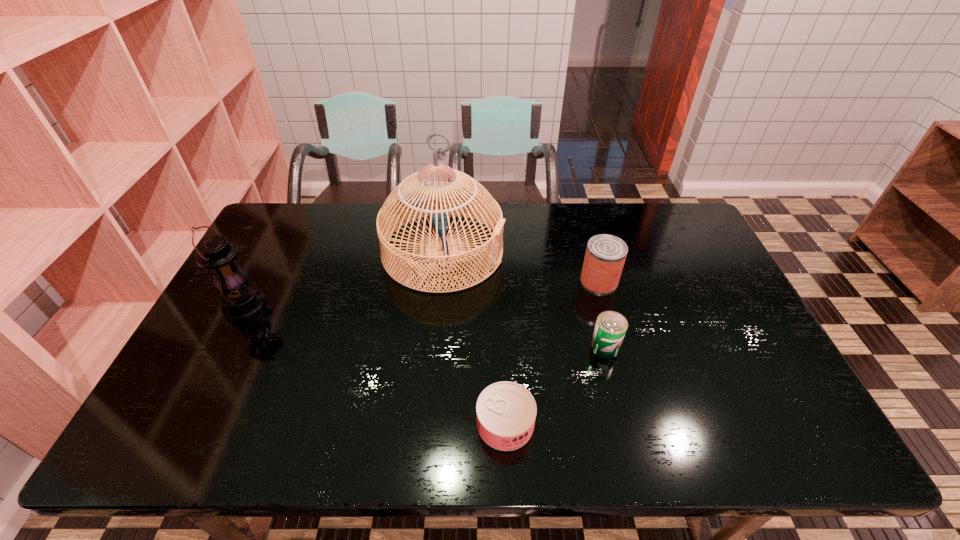
Locate the blank area located 0.400m above the fourth shortest object, indicating its light source in the image. Please provide its 2D coordinates. Your answer should be formatted as a tuple, i.e. [(x, y)], where the tuple contains the x and y coordinates of a point satisfying the conditions above.

[(406, 305)]

The image size is (960, 540). I want to click on vacant space located 0.110m on the back of the farthest can, so click(x=589, y=246).

Identify the location of free space located 0.190m on the left of the second shortest can. Image resolution: width=960 pixels, height=540 pixels. (519, 347).

Locate an element on the screen. This screenshot has width=960, height=540. free space located 0.320m on the back of the nearest object is located at coordinates (500, 301).

At what (x,y) coordinates should I click in order to perform the action: click on object at the far edge. Please return your answer as a coordinate pair (x, y). Looking at the image, I should click on (418, 196).

Image resolution: width=960 pixels, height=540 pixels. What are the coordinates of `object that is at the near edge` in the screenshot? It's located at (506, 411).

This screenshot has height=540, width=960. I want to click on object at the left edge, so coord(240,299).

Locate an element on the screen. This screenshot has height=540, width=960. vacant area at the far edge is located at coordinates (578, 244).

This screenshot has height=540, width=960. I want to click on free space at the near edge, so click(x=424, y=451).

In the image, there is a desktop. Identify the location of vacant area at the right edge. (670, 258).